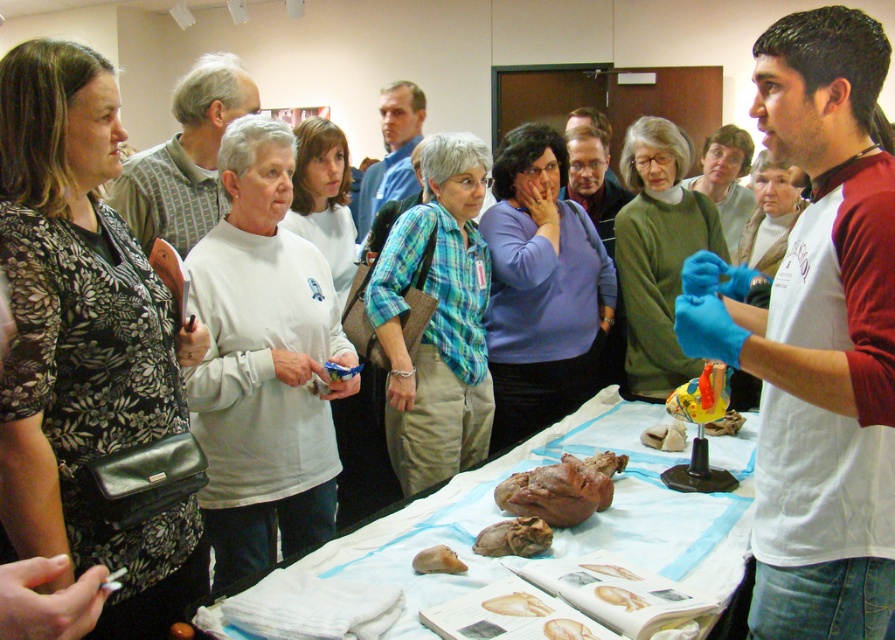
Which is above, yellowish matte bone at center or yellow rubber food at center?

yellow rubber food at center is above.

Can you confirm if yellowish matte bone at center is positioned to the right of yellow rubber food at center?

Incorrect, yellowish matte bone at center is not on the right side of yellow rubber food at center.

Identify the location of yellowish matte bone at center. The height and width of the screenshot is (640, 895). (516, 604).

Is gray knit sweater at upper center shorter than brown leather bone at center?

Incorrect, gray knit sweater at upper center's height does not fall short of brown leather bone at center's.

Looking at this image, is gray knit sweater at upper center behind brown leather bone at center?

No, gray knit sweater at upper center is closer to the viewer.

Between point (177, 141) and point (611, 474), which one is positioned in front?

Point (611, 474) is in front.

The width and height of the screenshot is (895, 640). I want to click on gray knit sweater at upper center, so click(185, 157).

Between white/red long-sleeved shirt at center-right and brown leather bone at center, which one has more height?

With more height is white/red long-sleeved shirt at center-right.

Can you confirm if white/red long-sleeved shirt at center-right is smaller than brown leather bone at center?

No.

Identify the location of white/red long-sleeved shirt at center-right. Image resolution: width=895 pixels, height=640 pixels. (817, 339).